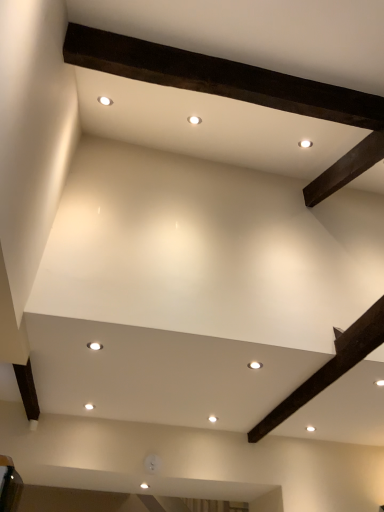
Question: Looking at their shapes, would you say white glossy light fixture at center, which appears as the first lighting when ordered from the bottom, is wider or thinner than white glossy light fixture at center, which ranks as the 2th lighting in right-to-left order?

Choices:
 (A) wide
 (B) thin

Answer: (A)

Question: Considering their positions, is white glossy light fixture at center, placed as the first lighting when sorted from back to front, located in front of or behind white glossy light fixture at center, which appears as the first lighting when viewed from the top?

Choices:
 (A) behind
 (B) front

Answer: (A)

Question: Is white glossy light fixture at center, the second lighting viewed from the front, spatially inside white glossy light fixture at center, which ranks as the 2th lighting in right-to-left order, or outside of it?

Choices:
 (A) outside
 (B) inside

Answer: (A)

Question: Visually, is white glossy light fixture at center, which appears as the first lighting when viewed from the top, positioned to the left or to the right of white glossy light fixture at center, acting as the first lighting starting from the right?

Choices:
 (A) left
 (B) right

Answer: (A)

Question: Looking at their shapes, would you say white glossy light fixture at center, placed as the first lighting when sorted from left to right, is wider or thinner than white glossy light fixture at center, placed as the first lighting when sorted from back to front?

Choices:
 (A) wide
 (B) thin

Answer: (B)

Question: From the image's perspective, is white glossy light fixture at center, placed as the first lighting when sorted from left to right, above or below white glossy light fixture at center, acting as the first lighting starting from the right?

Choices:
 (A) above
 (B) below

Answer: (A)

Question: Is point (96, 343) closer or farther from the camera than point (258, 361)?

Choices:
 (A) closer
 (B) farther

Answer: (A)